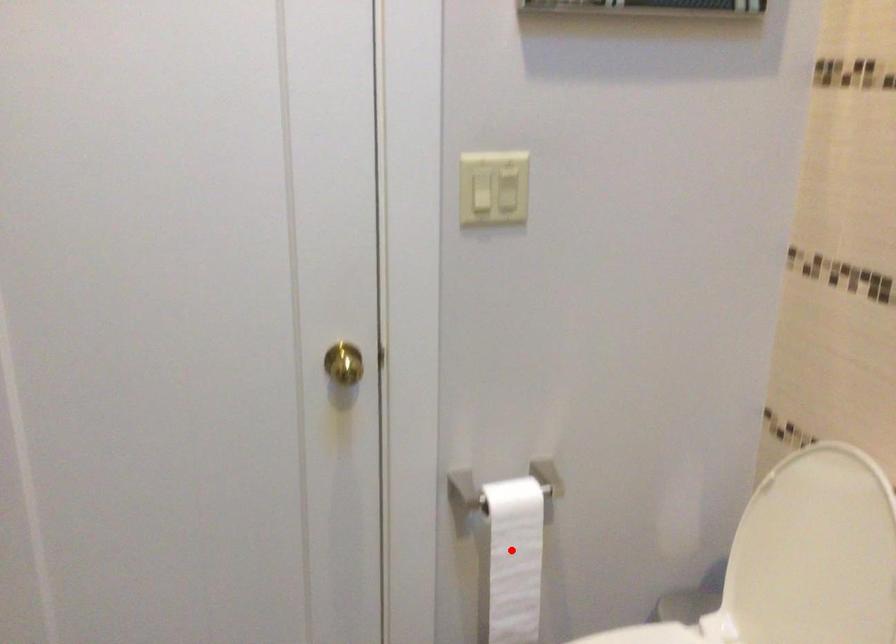
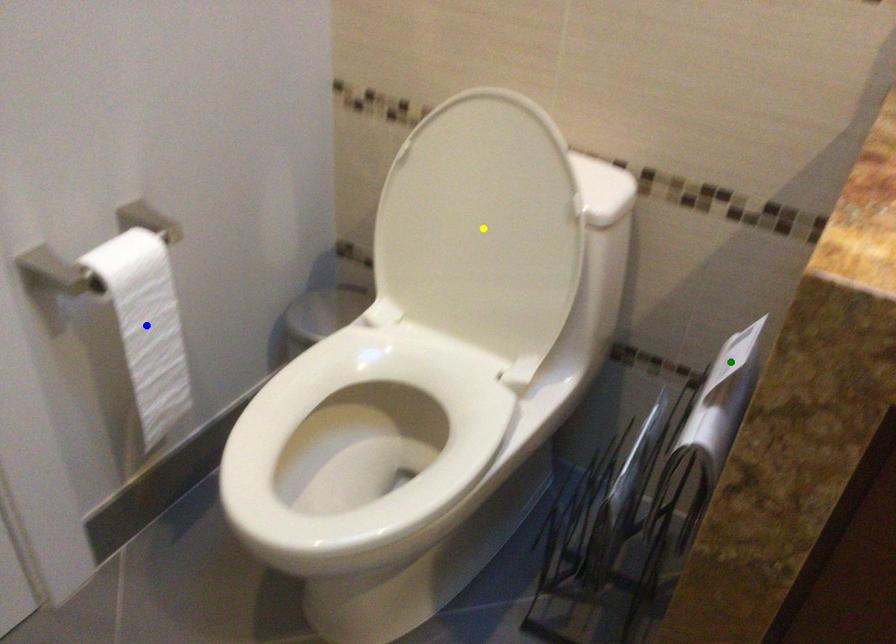
Question: I am providing you with two images of the same scene from different viewpoints. A red point is marked on the first image. You are given multiple points on the second image. Can you choose the point in image 2 that corresponds to the point in image 1?

Choices:
 (A) blue point
 (B) yellow point
 (C) green point

Answer: (A)